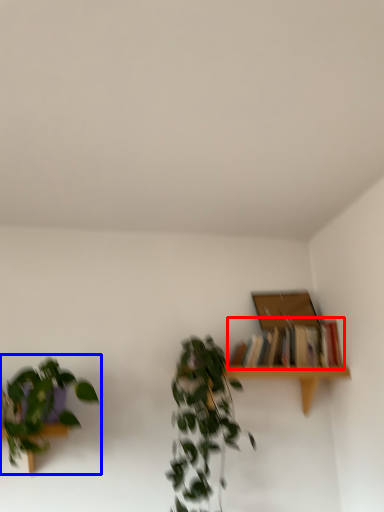
Question: Which object appears closest to the camera in this image, book (highlighted by a red box) or houseplant (highlighted by a blue box)?

Choices:
 (A) book
 (B) houseplant

Answer: (B)